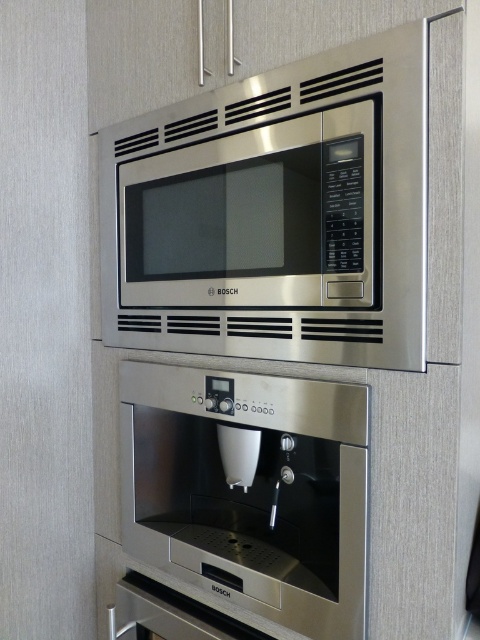
Question: Can you confirm if stainless steel microwave at upper center is positioned below stainless steel coffee machine at center?

Choices:
 (A) no
 (B) yes

Answer: (A)

Question: Does stainless steel microwave at upper center appear on the left side of stainless steel coffee machine at center?

Choices:
 (A) no
 (B) yes

Answer: (B)

Question: Considering the relative positions of stainless steel microwave at upper center and stainless steel coffee machine at center in the image provided, where is stainless steel microwave at upper center located with respect to stainless steel coffee machine at center?

Choices:
 (A) right
 (B) left

Answer: (B)

Question: Which object appears closest to the camera in this image?

Choices:
 (A) stainless steel coffee machine at center
 (B) stainless steel microwave at upper center

Answer: (B)